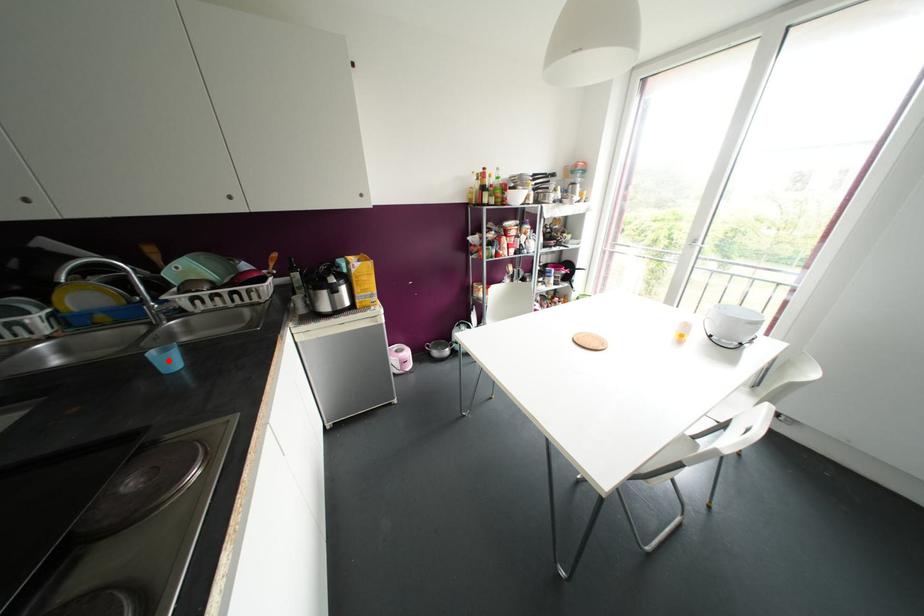
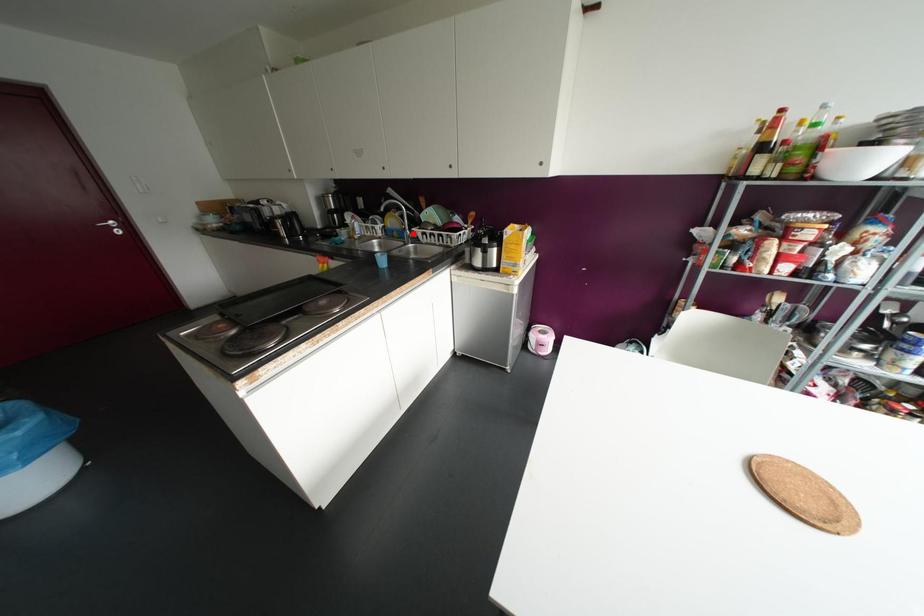
I am providing you with two images of the same scene from different viewpoints. A red point is marked on the first image and another point is marked on the second image. Does the point marked in image1 correspond to the same location as the one in image2?

No